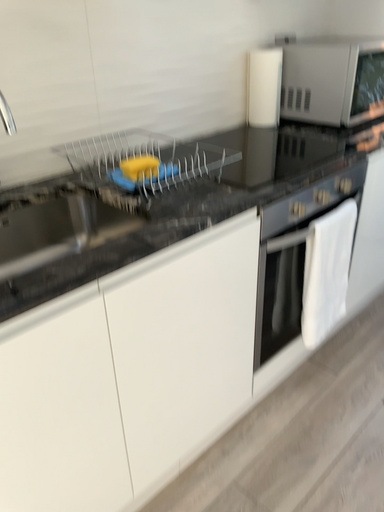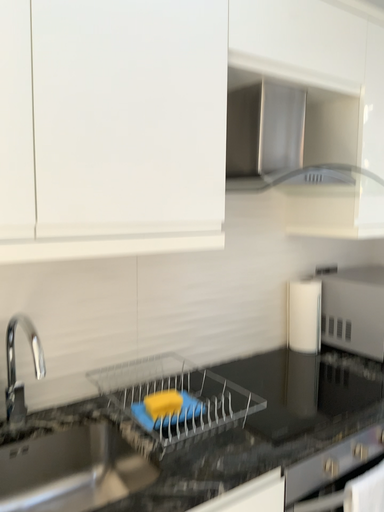
Question: Which way did the camera rotate in the video?

Choices:
 (A) rotated right
 (B) rotated left

Answer: (B)